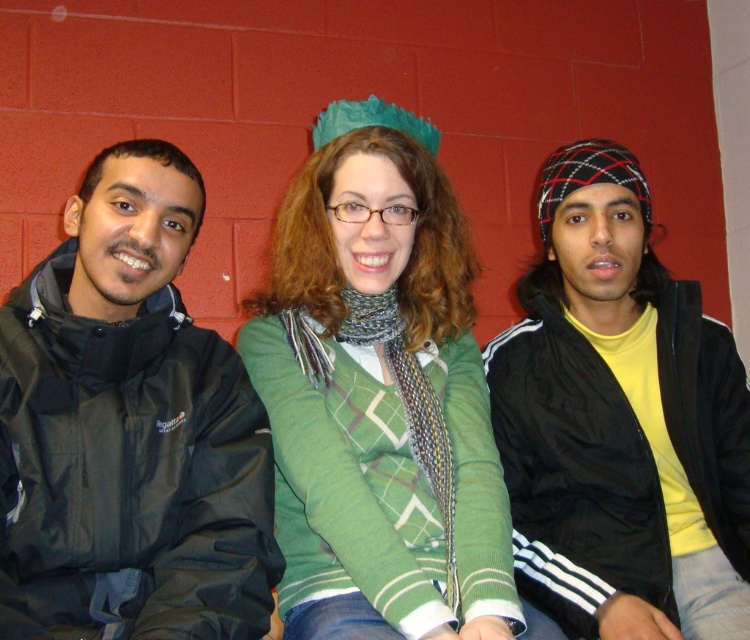
Question: Which of the following is the closest to the observer?

Choices:
 (A) (428, 296)
 (B) (645, 304)
 (C) (51, 525)

Answer: (C)

Question: Among these points, which one is farthest from the camera?

Choices:
 (A) (732, 486)
 (B) (382, 596)

Answer: (A)

Question: Is green knitted sweater at center bigger than black matte jacket at right?

Choices:
 (A) no
 (B) yes

Answer: (B)

Question: Does green knitted sweater at center have a lesser width compared to black matte jacket at right?

Choices:
 (A) no
 (B) yes

Answer: (B)

Question: Which is nearer to the matte black jacket at left?

Choices:
 (A) green knitted sweater at center
 (B) black matte jacket at right

Answer: (A)

Question: Does matte black jacket at left come behind black matte jacket at right?

Choices:
 (A) no
 (B) yes

Answer: (A)